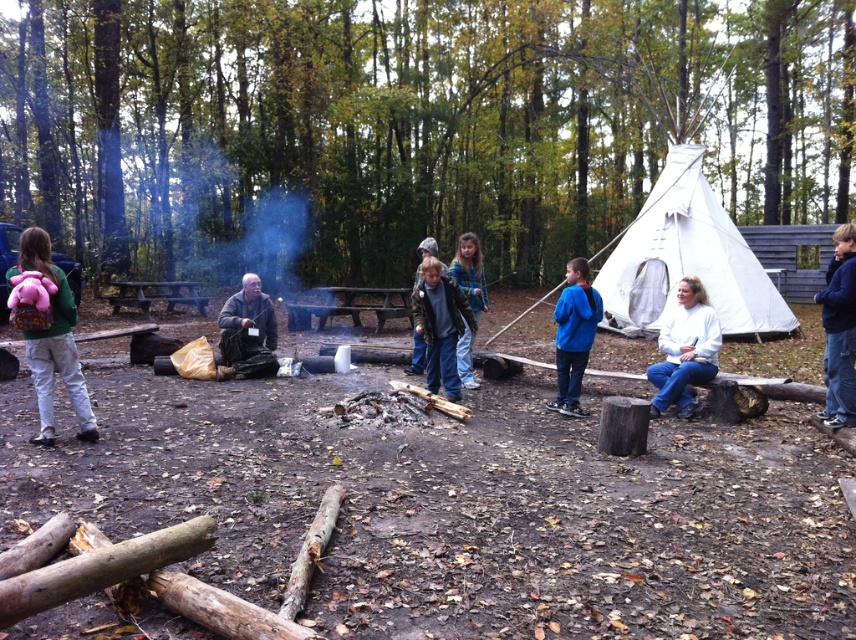
Can you confirm if white soft shirt at right is wider than dark brown leather jacket at center?

Yes, white soft shirt at right is wider than dark brown leather jacket at center.

What do you see at coordinates (685, 349) in the screenshot? This screenshot has width=856, height=640. I see `white soft shirt at right` at bounding box center [685, 349].

Describe the element at coordinates (685, 349) in the screenshot. I see `white soft shirt at right` at that location.

Find the location of a particular element. white soft shirt at right is located at coordinates (685, 349).

Between point (37, 273) and point (846, 392), which one is positioned in front?

Point (37, 273) is in front.

Is point (45, 442) behind point (830, 305)?

No, it is not.

You are a GUI agent. You are given a task and a screenshot of the screen. Output one action in this format:
    pyautogui.click(x=<x>, y=<y>)
    Task: Click on the pink fabric backpack at left
    The image size is (856, 640).
    Given the screenshot: What is the action you would take?
    pyautogui.click(x=49, y=333)

Between dark brown leather jacket at center and blue denim jeans at center, which one has less height?

dark brown leather jacket at center

Who is positioned more to the left, dark brown leather jacket at center or blue denim jeans at center?

dark brown leather jacket at center

Where is `dark brown leather jacket at center`? The width and height of the screenshot is (856, 640). dark brown leather jacket at center is located at coordinates (440, 324).